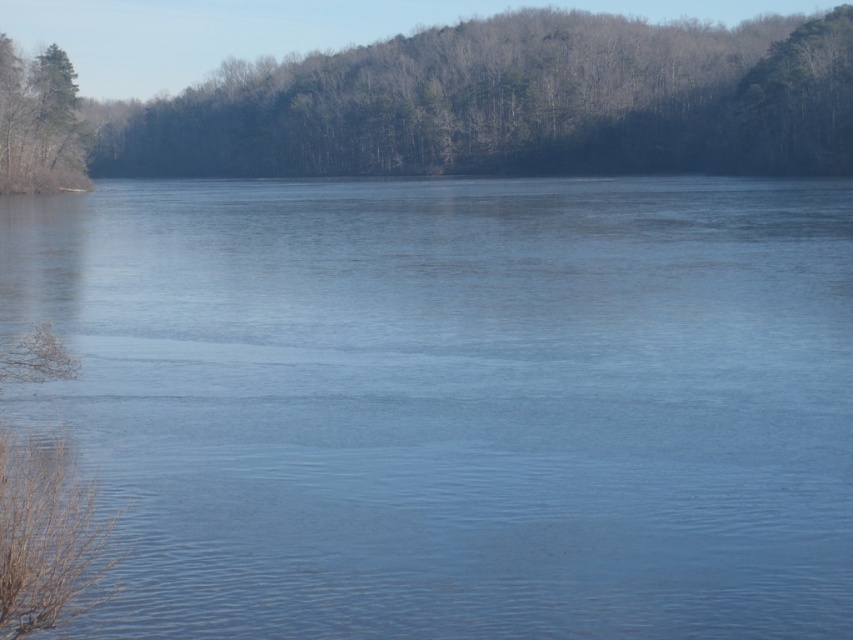
Is point (50, 280) positioned after point (36, 76)?

No, (50, 280) is in front of (36, 76).

The width and height of the screenshot is (853, 640). Identify the location of blue water at center. (453, 401).

Locate an element on the screen. The height and width of the screenshot is (640, 853). blue water at center is located at coordinates (453, 401).

Does blue water at center lie in front of green leafy trees at upper center?

That is True.

Between point (802, 456) and point (274, 138), which one is positioned in front?

Point (802, 456) is more forward.

I want to click on blue water at center, so click(x=453, y=401).

Who is taller, green leafy trees at upper center or green matte tree at upper left?

green leafy trees at upper center is taller.

The width and height of the screenshot is (853, 640). What do you see at coordinates (515, 104) in the screenshot?
I see `green leafy trees at upper center` at bounding box center [515, 104].

I want to click on green leafy trees at upper center, so [x=515, y=104].